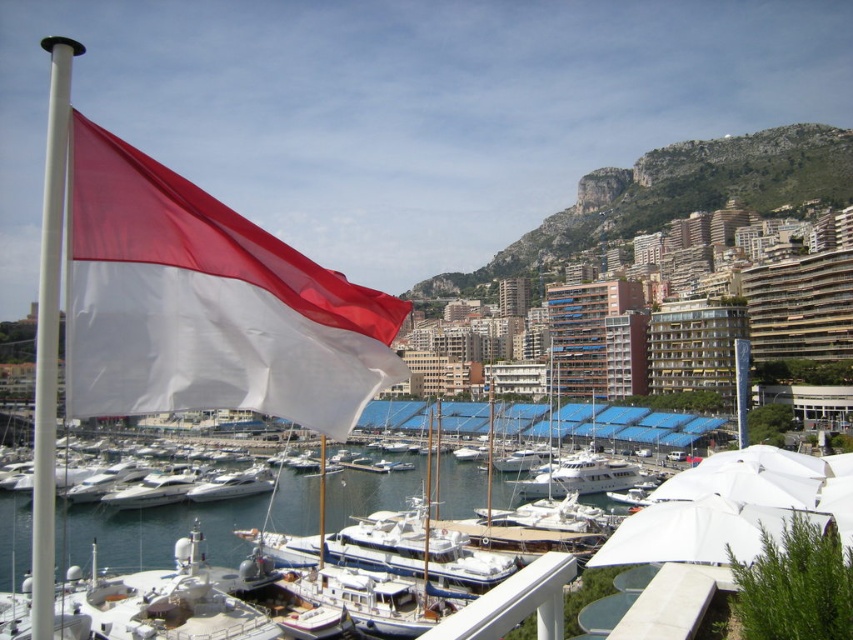
Can you confirm if red/white fabric flag at left is shorter than white glossy boat at center?

In fact, red/white fabric flag at left may be taller than white glossy boat at center.

Is red/white fabric flag at left to the left of white glossy boat at center from the viewer's perspective?

Incorrect, red/white fabric flag at left is not on the left side of white glossy boat at center.

Who is more forward, (80, 212) or (218, 480)?

Positioned in front is point (80, 212).

The image size is (853, 640). What are the coordinates of `red/white fabric flag at left` in the screenshot? It's located at (206, 304).